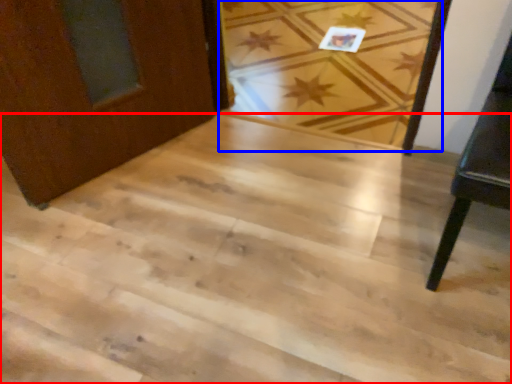
Question: Which object appears farthest to the camera in this image, stairwell (highlighted by a red box) or plank (highlighted by a blue box)?

Choices:
 (A) stairwell
 (B) plank

Answer: (B)